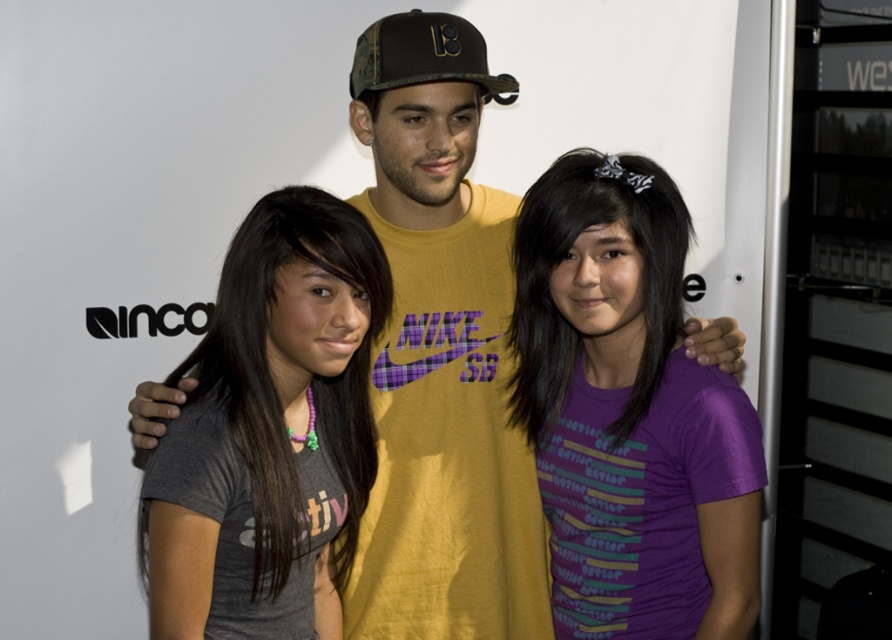
Does point (624, 636) lie behind point (312, 406)?

No, (624, 636) is in front of (312, 406).

Locate an element on the screen. purple printed shirt at center is located at coordinates (620, 401).

Is the position of yellow cotton t-shirt at center less distant than that of camouflage fabric baseball cap at center?

No, it is not.

Does yellow cotton t-shirt at center have a lesser height compared to camouflage fabric baseball cap at center?

No.

Does point (401, 129) lie behind point (390, 84)?

Yes, it is.

Find the location of a particular element. This screenshot has height=640, width=892. yellow cotton t-shirt at center is located at coordinates (443, 392).

Is the position of yellow cotton t-shirt at center more distant than that of gray matte t-shirt at left?

Yes, it is behind gray matte t-shirt at left.

Can you confirm if yellow cotton t-shirt at center is taller than gray matte t-shirt at left?

Yes, yellow cotton t-shirt at center is taller than gray matte t-shirt at left.

Is point (354, 600) closer to viewer compared to point (252, 628)?

No.

I want to click on yellow cotton t-shirt at center, so click(443, 392).